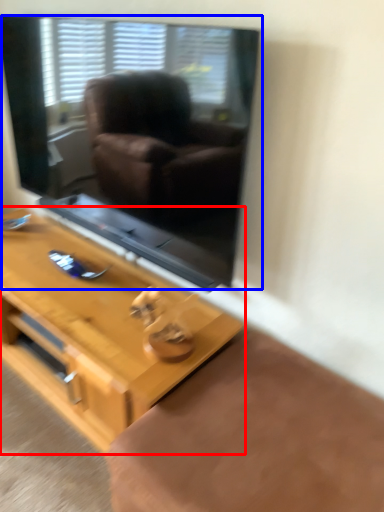
Question: Which point is further to the camera, table (highlighted by a red box) or window screen (highlighted by a blue box)?

Choices:
 (A) table
 (B) window screen

Answer: (A)